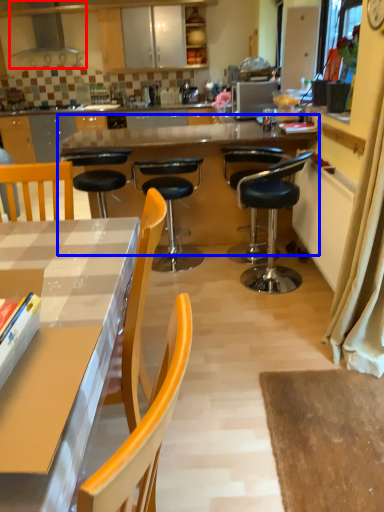
Question: Which of the following is the farthest to the observer, kitchen appliance (highlighted by a red box) or round table (highlighted by a blue box)?

Choices:
 (A) kitchen appliance
 (B) round table

Answer: (A)